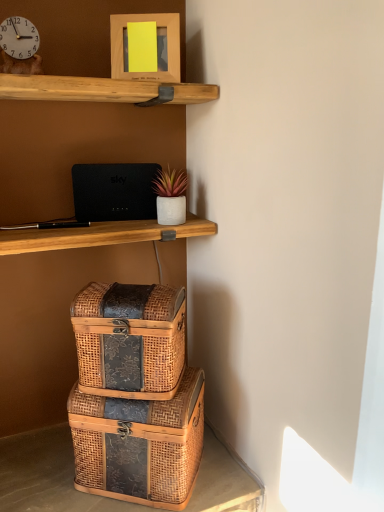
This screenshot has width=384, height=512. I want to click on free space to the left of woven wood box at center, which appears as the second box when viewed from the top, so click(45, 471).